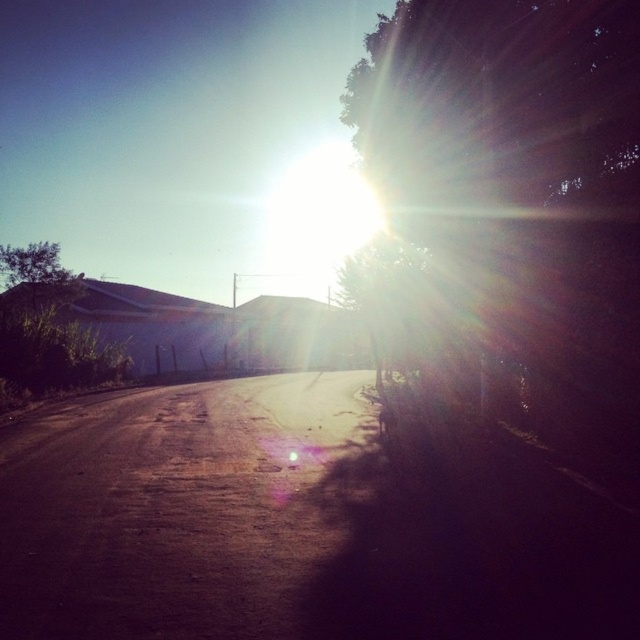
Question: Does green leafy tree at upper right have a larger size compared to dull brown dirt track at center?

Choices:
 (A) no
 (B) yes

Answer: (B)

Question: Is green leafy tree at upper right to the right of dull brown dirt track at center from the viewer's perspective?

Choices:
 (A) no
 (B) yes

Answer: (B)

Question: Which point is farther to the camera?

Choices:
 (A) (605, 19)
 (B) (115, 349)
 (C) (250, 460)

Answer: (B)

Question: Which object is closer to the camera taking this photo?

Choices:
 (A) green leafy tree at upper left
 (B) green leafy tree at upper right
 (C) dull brown dirt track at center

Answer: (C)

Question: Can you confirm if dull brown dirt track at center is positioned to the right of green leafy tree at upper left?

Choices:
 (A) no
 (B) yes

Answer: (B)

Question: Which point appears farthest from the camera in this image?

Choices:
 (A) (49, 380)
 (B) (452, 17)

Answer: (A)